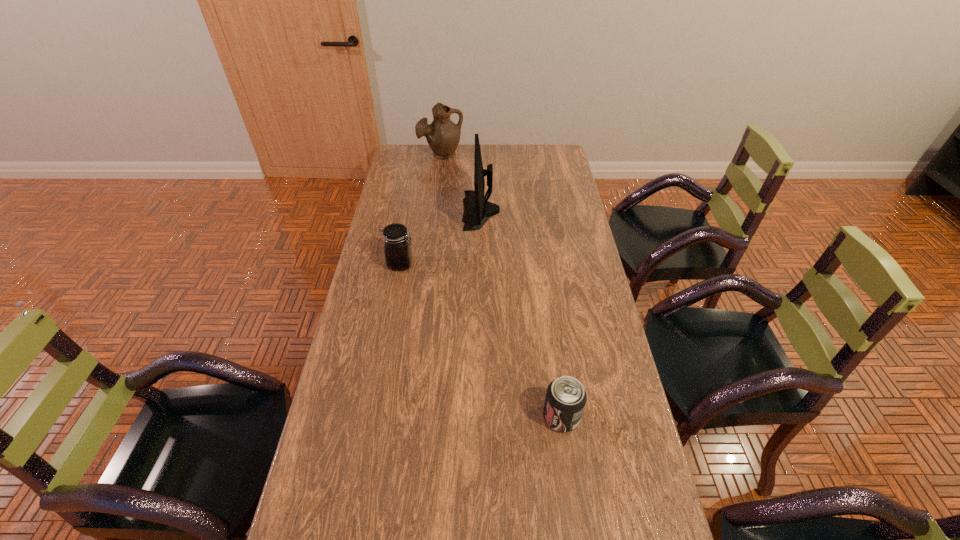
In order to click on vacant area in the image that satisfies the following two spatial constraints: 1. on the lid of the rightmost object; 2. on the right side of the jar in this screenshot , I will do `click(372, 416)`.